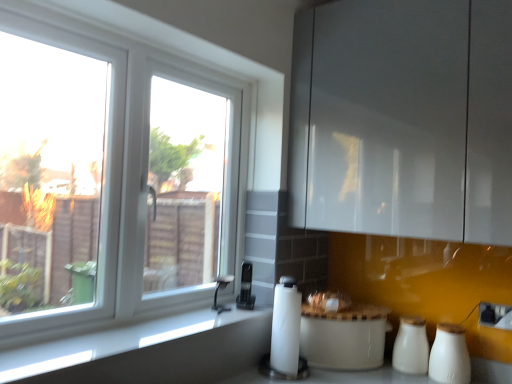
The image size is (512, 384). Find the location of `vacant space in front of satin nickel faucet at lower center`. vacant space in front of satin nickel faucet at lower center is located at coordinates (206, 319).